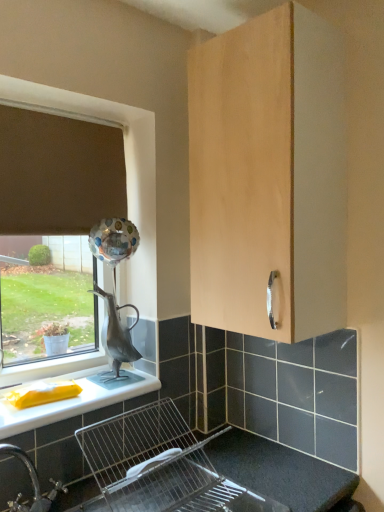
This screenshot has height=512, width=384. I want to click on free space above white glossy countertop at lower left (from a real-world perspective), so click(x=72, y=392).